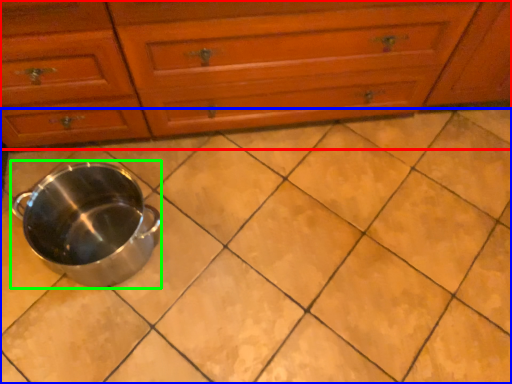
Question: Based on their relative distances, which object is farther from chest of drawers (highlighted by a red box)? Choose from ceramic tile (highlighted by a blue box) and crock pot (highlighted by a green box).

Choices:
 (A) ceramic tile
 (B) crock pot

Answer: (A)